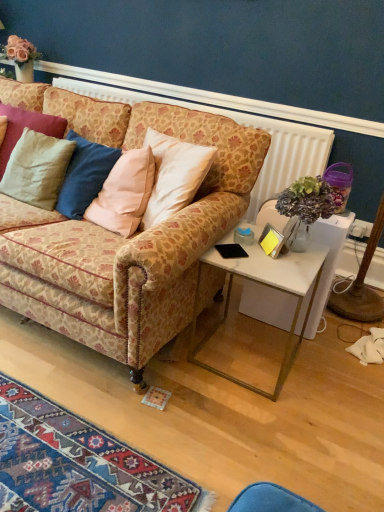
At what (x,y) coordinates should I click in order to perform the action: click on white marble side table at right. Please return your answer as a coordinate pair (x, y). This screenshot has width=384, height=512. Looking at the image, I should click on (267, 286).

How much space does matte beige pillow at left, which appears as the 1th pillow when viewed from the top, occupy horizontally?

It is 5.32 inches.

The width and height of the screenshot is (384, 512). I want to click on white marble desk at right, so click(327, 262).

Where is `white marble side table at right`? white marble side table at right is located at coordinates (267, 286).

In the scene shown: From the image's perspective, would you say matte beige pillow at left, the 2th pillow positioned from the bottom, is positioned over patterned fabric couch at center?

Yes, from the image's perspective, matte beige pillow at left, the 2th pillow positioned from the bottom, is over patterned fabric couch at center.

Which object is closer to the camera, matte beige pillow at left, the 2th pillow positioned from the bottom, or patterned fabric couch at center?

patterned fabric couch at center.

Considering the sizes of objects matte beige pillow at left, the 2th pillow positioned from the bottom, and patterned fabric couch at center in the image provided, who is thinner, matte beige pillow at left, the 2th pillow positioned from the bottom, or patterned fabric couch at center?

With smaller width is matte beige pillow at left, the 2th pillow positioned from the bottom.

Is matte beige pillow at left, which appears as the 1th pillow when viewed from the top, surrounding patterned fabric couch at center?

No.

Based on their positions, is matte beige pillow at left, the second pillow from the top, located to the left or right of white marble side table at right?

Based on their positions, matte beige pillow at left, the second pillow from the top, is located to the left of white marble side table at right.

Is matte beige pillow at left, positioned as the 1th pillow in bottom-to-top order, beside white marble side table at right?

No.

Is matte beige pillow at left, the second pillow from the top, turned away from white marble side table at right?

No, matte beige pillow at left, the second pillow from the top, is not facing the opposite direction of white marble side table at right.

Consider the image. Which object is thinner, matte beige pillow at left, the second pillow from the top, or white marble side table at right?

matte beige pillow at left, the second pillow from the top, is thinner.

Locate an element on the screen. The image size is (384, 512). desk on the right of white marble side table at right is located at coordinates (327, 262).

In terms of width, does white marble side table at right look wider or thinner when compared to white marble desk at right?

In the image, white marble side table at right appears to be wider than white marble desk at right.

Based on their sizes in the image, would you say white marble side table at right is bigger or smaller than white marble desk at right?

Considering their sizes, white marble side table at right takes up more space than white marble desk at right.

Based on the photo, from their relative heights in the image, would you say white marble side table at right is taller or shorter than white marble desk at right?

white marble side table at right is shorter than white marble desk at right.

Could you tell me if patterned fabric couch at center is facing matte beige pillow at left, which appears as the 1th pillow when viewed from the top?

Yes, patterned fabric couch at center is oriented towards matte beige pillow at left, which appears as the 1th pillow when viewed from the top.

Which is behind, point (203, 291) or point (9, 152)?

The point (9, 152) is more distant.

From a real-world perspective, is patterned fabric couch at center positioned above or below matte beige pillow at left, which appears as the 1th pillow when viewed from the top?

patterned fabric couch at center is situated lower than matte beige pillow at left, which appears as the 1th pillow when viewed from the top, in the real world.

Is patterned fabric couch at center far from matte beige pillow at left, which appears as the 1th pillow when viewed from the top?

Actually, patterned fabric couch at center and matte beige pillow at left, which appears as the 1th pillow when viewed from the top, are a little close together.

Can you confirm if matte beige pillow at left, positioned as the 1th pillow in bottom-to-top order, is shorter than matte beige pillow at left, which appears as the 1th pillow when viewed from the top?

Incorrect, the height of matte beige pillow at left, positioned as the 1th pillow in bottom-to-top order, does not fall short of that of matte beige pillow at left, which appears as the 1th pillow when viewed from the top.

Can you confirm if matte beige pillow at left, the second pillow from the top, is bigger than matte beige pillow at left, the 2th pillow positioned from the bottom?

Correct, matte beige pillow at left, the second pillow from the top, is larger in size than matte beige pillow at left, the 2th pillow positioned from the bottom.

Is matte beige pillow at left, the second pillow from the top, to the right of matte beige pillow at left, which appears as the 1th pillow when viewed from the top, from the viewer's perspective?

Correct, you'll find matte beige pillow at left, the second pillow from the top, to the right of matte beige pillow at left, which appears as the 1th pillow when viewed from the top.

From the image's perspective, which one is positioned lower, matte beige pillow at left, positioned as the 1th pillow in bottom-to-top order, or matte beige pillow at left, the 2th pillow positioned from the bottom?

From the image's view, matte beige pillow at left, positioned as the 1th pillow in bottom-to-top order, is below.

Which of these two, white marble side table at right or matte beige pillow at left, which appears as the 1th pillow when viewed from the top, is wider?

white marble side table at right.

Is white marble side table at right further to the viewer compared to matte beige pillow at left, which appears as the 1th pillow when viewed from the top?

No, white marble side table at right is closer to the viewer.

From the image's perspective, is white marble side table at right located beneath matte beige pillow at left, the 2th pillow positioned from the bottom?

Yes, from the image's perspective, white marble side table at right is below matte beige pillow at left, the 2th pillow positioned from the bottom.

From the picture: From a real-world perspective, who is located lower, white marble side table at right or patterned fabric couch at center?

From a 3D spatial view, white marble side table at right is below.

Who is shorter, white marble side table at right or patterned fabric couch at center?

white marble side table at right is shorter.

Looking at this image, between white marble side table at right and patterned fabric couch at center, which one is positioned behind?

→ white marble side table at right is more distant.

Is white marble side table at right not close to patterned fabric couch at center?

No, white marble side table at right is in close proximity to patterned fabric couch at center.

Locate an element on the screen. The image size is (384, 512). studio couch located underneath the matte beige pillow at left, the 2th pillow positioned from the bottom (from a real-world perspective) is located at coordinates point(123,238).

Where is `table that is below the matte beige pillow at left, the second pillow from the top (from the image's perspective)`? table that is below the matte beige pillow at left, the second pillow from the top (from the image's perspective) is located at coordinates (267, 286).

From the image, which object appears to be farther from matte beige pillow at left, positioned as the 1th pillow in bottom-to-top order, white marble desk at right or matte beige pillow at left, which appears as the 1th pillow when viewed from the top?

Among the two, white marble desk at right is located further to matte beige pillow at left, positioned as the 1th pillow in bottom-to-top order.

Estimate the real-world distances between objects in this image. Which object is further from matte beige pillow at left, positioned as the 1th pillow in bottom-to-top order, white marble side table at right or matte beige pillow at left, the 2th pillow positioned from the bottom?

white marble side table at right lies further to matte beige pillow at left, positioned as the 1th pillow in bottom-to-top order, than the other object.

When comparing their distances from white marble desk at right, does matte beige pillow at left, which appears as the 1th pillow when viewed from the top, or patterned fabric couch at center seem closer?

patterned fabric couch at center is closer to white marble desk at right.

Looking at the image, which one is located closer to white marble desk at right, matte beige pillow at left, which appears as the 1th pillow when viewed from the top, or white marble side table at right?

white marble side table at right is closer to white marble desk at right.

When comparing their distances from matte beige pillow at left, positioned as the 1th pillow in bottom-to-top order, does matte beige pillow at left, the 2th pillow positioned from the bottom, or white marble desk at right seem further?

white marble desk at right.

When comparing their distances from matte beige pillow at left, which appears as the 1th pillow when viewed from the top, does matte beige pillow at left, positioned as the 1th pillow in bottom-to-top order, or patterned fabric couch at center seem further?

patterned fabric couch at center lies further to matte beige pillow at left, which appears as the 1th pillow when viewed from the top, than the other object.

Estimate the real-world distances between objects in this image. Which object is further from white marble side table at right, matte beige pillow at left, the 2th pillow positioned from the bottom, or patterned fabric couch at center?

matte beige pillow at left, the 2th pillow positioned from the bottom, is further to white marble side table at right.

Considering their positions, is patterned fabric couch at center positioned further to white marble side table at right than matte beige pillow at left, positioned as the 1th pillow in bottom-to-top order?

matte beige pillow at left, positioned as the 1th pillow in bottom-to-top order, is further to white marble side table at right.

You are a GUI agent. You are given a task and a screenshot of the screen. Output one action in this format:
    pyautogui.click(x=<x>, y=<y>)
    Task: Click on the studio couch between matte beige pillow at left, positioned as the 1th pillow in bottom-to-top order, and white marble side table at right from left to right
    The image size is (384, 512).
    Given the screenshot: What is the action you would take?
    pyautogui.click(x=123, y=238)

The width and height of the screenshot is (384, 512). I want to click on studio couch between matte beige pillow at left, the 2th pillow positioned from the bottom, and white marble desk at right, so click(123, 238).

Find the location of a particular element. The height and width of the screenshot is (512, 384). studio couch between matte beige pillow at left, positioned as the 1th pillow in bottom-to-top order, and white marble desk at right is located at coordinates (123, 238).

Identify the location of studio couch between matte beige pillow at left, the 2th pillow positioned from the bottom, and white marble side table at right from left to right. (123, 238).